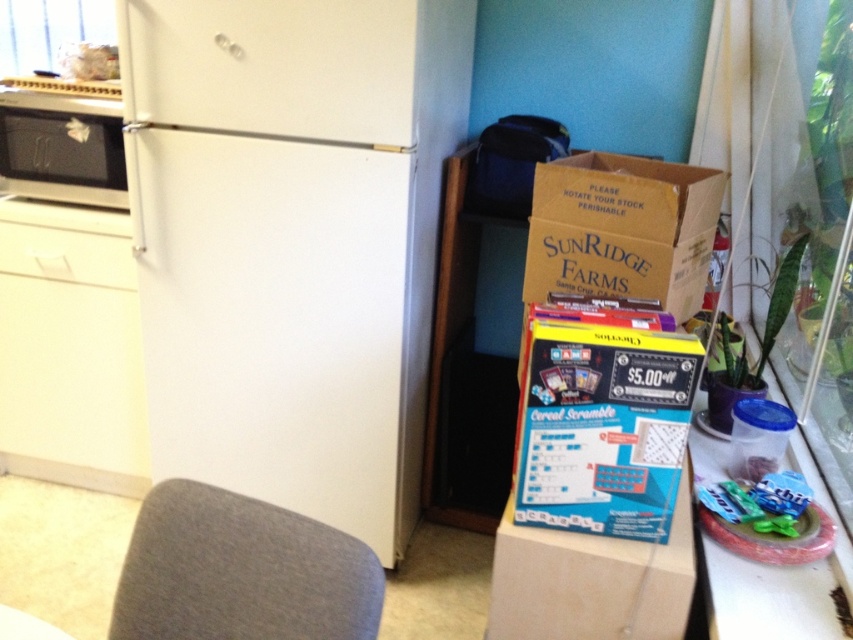
You are a guest entering the kitchen and see the gray fabric chair at lower left and the clear plastic container at lower right. Which object is taller?

The clear plastic container at lower right is taller than the gray fabric chair at lower left.